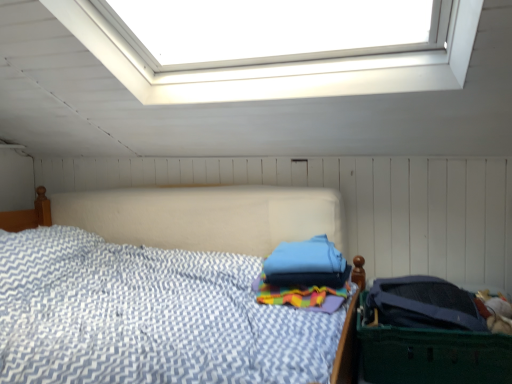
What do you see at coordinates (431, 354) in the screenshot?
I see `dark green plastic laundry basket at right` at bounding box center [431, 354].

Locate an element on the screen. Image resolution: width=512 pixels, height=384 pixels. dark green plastic laundry basket at right is located at coordinates (431, 354).

In the scene shown: In order to face blue fabric pillow at center, should I rotate leftwards or rightwards?

You should rotate right by 6.700 degrees.

What do you see at coordinates (307, 264) in the screenshot?
I see `blue fabric pillow at center` at bounding box center [307, 264].

Where is `blue fabric pillow at center`? The image size is (512, 384). blue fabric pillow at center is located at coordinates (307, 264).

The height and width of the screenshot is (384, 512). In order to click on dark green plastic laundry basket at right in this screenshot , I will do `click(431, 354)`.

Can you confirm if dark green plastic laundry basket at right is positioned to the left of blue fabric pillow at center?

No.

Considering the positions of objects dark green plastic laundry basket at right and blue fabric pillow at center in the image provided, who is in front, dark green plastic laundry basket at right or blue fabric pillow at center?

dark green plastic laundry basket at right is in front.

Which is in front, point (434, 338) or point (295, 266)?

The point (434, 338) is in front.

From the image's perspective, is dark green plastic laundry basket at right on blue fabric pillow at center?

Incorrect, from the image's perspective, dark green plastic laundry basket at right is lower than blue fabric pillow at center.

From a real-world perspective, is dark green plastic laundry basket at right positioned over blue fabric pillow at center based on gravity?

Incorrect, from a real-world perspective, dark green plastic laundry basket at right is lower than blue fabric pillow at center.

Is dark green plastic laundry basket at right thinner than blue fabric pillow at center?

In fact, dark green plastic laundry basket at right might be wider than blue fabric pillow at center.

Who is shorter, dark green plastic laundry basket at right or blue fabric pillow at center?

blue fabric pillow at center.

Based on their sizes in the image, would you say dark green plastic laundry basket at right is bigger or smaller than blue fabric pillow at center?

dark green plastic laundry basket at right is bigger than blue fabric pillow at center.

Does dark green plastic laundry basket at right contain blue fabric pillow at center?

Definitely not — blue fabric pillow at center is not inside dark green plastic laundry basket at right.

Does dark green plastic laundry basket at right touch blue fabric pillow at center?

dark green plastic laundry basket at right and blue fabric pillow at center are not in contact.

Is dark green plastic laundry basket at right aimed at blue fabric pillow at center?

No, dark green plastic laundry basket at right is not facing towards blue fabric pillow at center.

Can you tell me how much dark green plastic laundry basket at right and blue fabric pillow at center differ in facing direction?

The angular difference between dark green plastic laundry basket at right and blue fabric pillow at center is 5.94 degrees.

Image resolution: width=512 pixels, height=384 pixels. Identify the location of pillow that is on the left side of dark green plastic laundry basket at right. (307, 264).

Consider the image. Visually, is blue fabric pillow at center positioned to the left or to the right of dark green plastic laundry basket at right?

blue fabric pillow at center is positioned on dark green plastic laundry basket at right's left side.

Is the depth of blue fabric pillow at center less than that of dark green plastic laundry basket at right?

No, blue fabric pillow at center is further to the viewer.

Considering the positions of points (277, 274) and (417, 332), is point (277, 274) closer to camera compared to point (417, 332)?

No.

From the image's perspective, which object appears higher, blue fabric pillow at center or dark green plastic laundry basket at right?

From the image's view, blue fabric pillow at center is above.

Looking at this image, from a real-world perspective, relative to dark green plastic laundry basket at right, is blue fabric pillow at center vertically above or below?

Clearly, from a real-world perspective, blue fabric pillow at center is above dark green plastic laundry basket at right.

Between blue fabric pillow at center and dark green plastic laundry basket at right, which one has larger width?

dark green plastic laundry basket at right.

Considering the sizes of objects blue fabric pillow at center and dark green plastic laundry basket at right in the image provided, who is shorter, blue fabric pillow at center or dark green plastic laundry basket at right?

blue fabric pillow at center.

From the picture: Between blue fabric pillow at center and dark green plastic laundry basket at right, which one has smaller size?

blue fabric pillow at center.

Can dark green plastic laundry basket at right be found inside blue fabric pillow at center?

No, dark green plastic laundry basket at right is located outside of blue fabric pillow at center.

Is blue fabric pillow at center far away from dark green plastic laundry basket at right?

That's not correct — blue fabric pillow at center is a little close to dark green plastic laundry basket at right.

Is blue fabric pillow at center turned away from dark green plastic laundry basket at right?

No, blue fabric pillow at center's orientation is not away from dark green plastic laundry basket at right.

How different are the orientations of blue fabric pillow at center and dark green plastic laundry basket at right in degrees?

The angle between the facing direction of blue fabric pillow at center and the facing direction of dark green plastic laundry basket at right is 5.94 degrees.

In the image, there is a blue fabric pillow at center. In order to click on laundry basket below it (from a real-world perspective) in this screenshot , I will do `click(431, 354)`.

You are a GUI agent. You are given a task and a screenshot of the screen. Output one action in this format:
    pyautogui.click(x=<x>, y=<y>)
    Task: Click on the pillow that is above the dark green plastic laundry basket at right (from the image's perspective)
    
    Given the screenshot: What is the action you would take?
    pyautogui.click(x=307, y=264)

Where is `laundry basket that appears below the blue fabric pillow at center (from the image's perspective)`? The width and height of the screenshot is (512, 384). laundry basket that appears below the blue fabric pillow at center (from the image's perspective) is located at coordinates (431, 354).